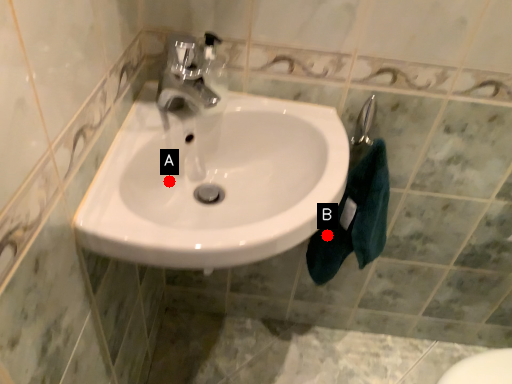
Question: Two points are circled on the image, labeled by A and B beside each circle. Among these points, which one is nearest to the camera?

Choices:
 (A) A is closer
 (B) B is closer

Answer: (A)